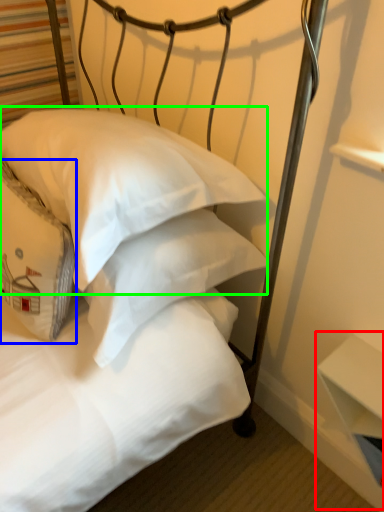
Question: Which is nearer to the table (highlighted by a red box)? pillow (highlighted by a blue box) or pillow (highlighted by a green box).

Choices:
 (A) pillow
 (B) pillow

Answer: (B)